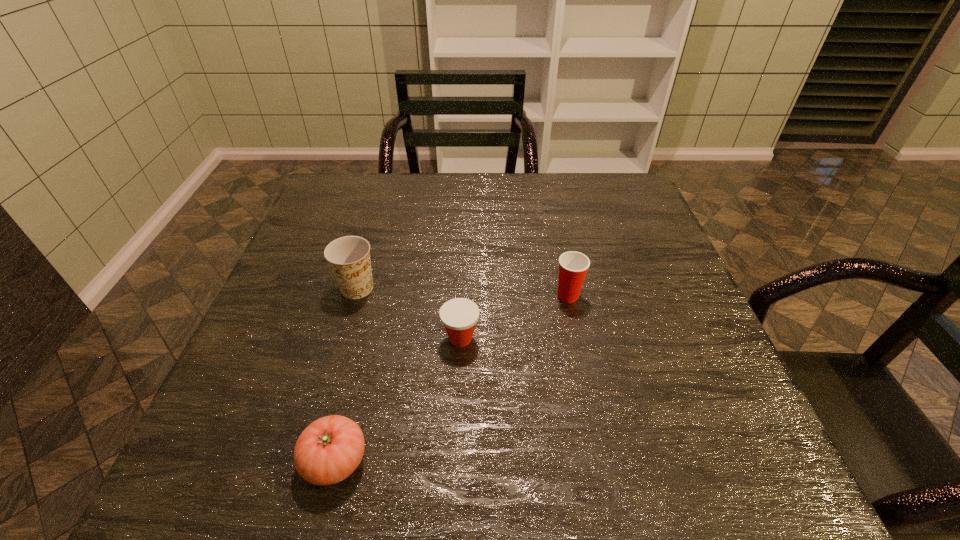
This screenshot has width=960, height=540. In order to click on free spot between the rightmost Dixie cup and the leftmost Dixie cup in this screenshot , I will do `click(463, 292)`.

Where is `vacant space in between the third object from left to right and the leftmost Dixie cup`? Image resolution: width=960 pixels, height=540 pixels. vacant space in between the third object from left to right and the leftmost Dixie cup is located at coordinates (409, 313).

At what (x,y) coordinates should I click in order to perform the action: click on vacant area that lies between the nearest Dixie cup and the rightmost Dixie cup. Please return your answer as a coordinate pair (x, y). Image resolution: width=960 pixels, height=540 pixels. Looking at the image, I should click on (515, 317).

Where is `free spot between the tomato and the nearest Dixie cup`? free spot between the tomato and the nearest Dixie cup is located at coordinates (397, 400).

This screenshot has width=960, height=540. What are the coordinates of `free space between the nearest Dixie cup and the rightmost Dixie cup` in the screenshot? It's located at (515, 317).

In order to click on free space between the second object from right to left and the tomato in this screenshot , I will do `click(397, 400)`.

Identify which object is the second nearest to the second nearest object. Please provide its 2D coordinates. Your answer should be formatted as a tuple, i.e. [(x, y)], where the tuple contains the x and y coordinates of a point satisfying the conditions above.

[(573, 266)]

You are a GUI agent. You are given a task and a screenshot of the screen. Output one action in this format:
    pyautogui.click(x=<x>, y=<y>)
    Task: Click on the closest object to the tomato
    
    Given the screenshot: What is the action you would take?
    pyautogui.click(x=459, y=316)

The width and height of the screenshot is (960, 540). Identify the location of Dixie cup that is the closest to the tomato. (459, 316).

Point out which Dixie cup is positioned as the second nearest to the shortest Dixie cup. Please provide its 2D coordinates. Your answer should be formatted as a tuple, i.e. [(x, y)], where the tuple contains the x and y coordinates of a point satisfying the conditions above.

[(573, 266)]